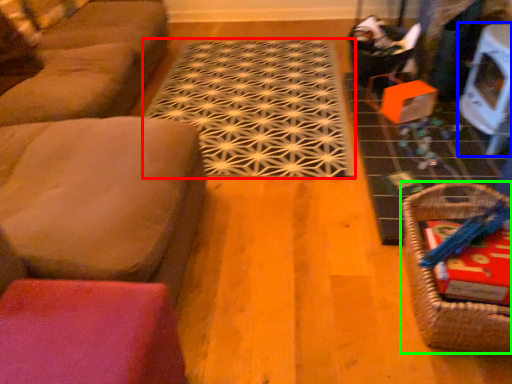
Question: Which object is positioned closest to doormat (highlighted by a red box)? Select from table (highlighted by a blue box) and basket (highlighted by a green box).

Choices:
 (A) table
 (B) basket

Answer: (A)